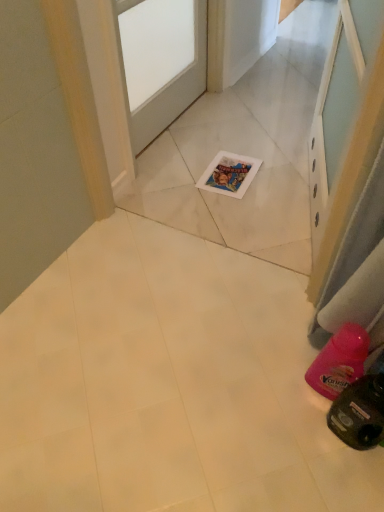
The height and width of the screenshot is (512, 384). I want to click on vacant area to the right of white matte door at center, so click(x=236, y=135).